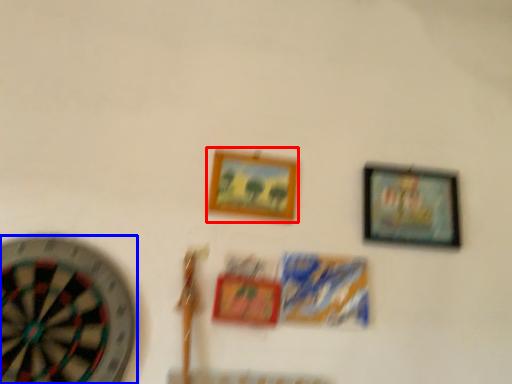
Question: Which object appears closest to the camera in this image, picture frame (highlighted by a red box) or wheel (highlighted by a blue box)?

Choices:
 (A) picture frame
 (B) wheel

Answer: (B)